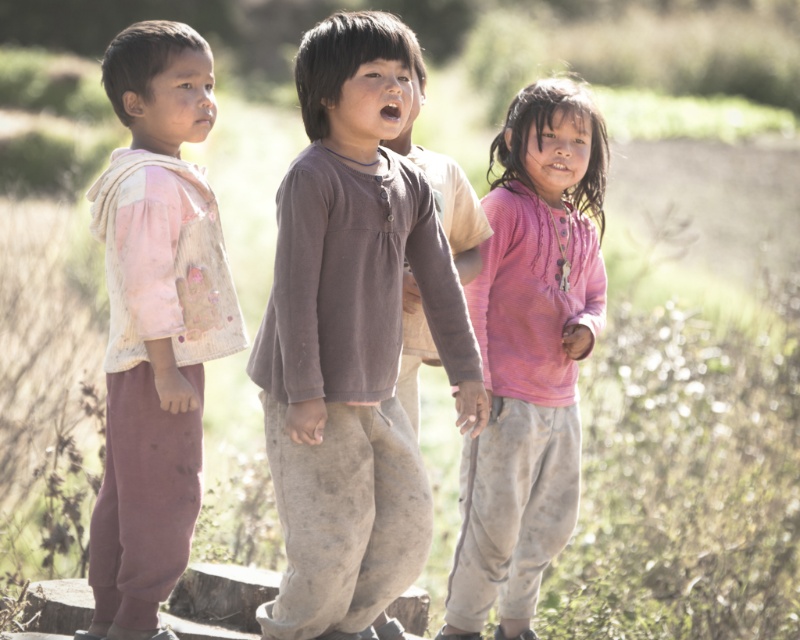
You are a photographer trying to capture a group photo of the brown cotton shirt at center and the pink fabric vest at left. You want to ensure that both subjects are clearly visible in the frame. Based on their positions, which subject should you focus on first to ensure they are in sharp focus?

The brown cotton shirt at center is below the pink fabric vest at left, so you should focus on the pink fabric vest at left first since it is closer to the camera. This will ensure it stays in focus while the brown cotton shirt at center may still be in focus depending on the depth of field.

You are a photographer trying to focus on the middle child in the image. The middle child is wearing a brown cotton shirt at center and a pink ribbed sweater at center. Which clothing item is closer to the camera?

Result: The brown cotton shirt at center is in front of the pink ribbed sweater at center, so the brown cotton shirt at center is closer to the camera.

You are a fashion designer observing the three children in the image. You need to determine which clothing item, the pink fabric vest at left or the pink ribbed sweater at center, would require more fabric to produce. Based on their sizes in the image, which one would need more material?

The pink ribbed sweater at center requires more fabric than the pink fabric vest at left because it has a greater height.